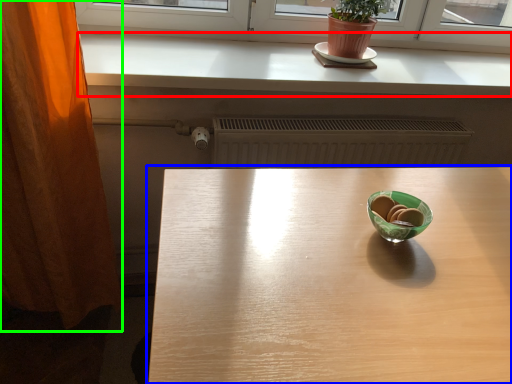
Question: Which object is the closest to the counter top (highlighted by a red box)? Choose among these: table (highlighted by a blue box) or curtain (highlighted by a green box).

Choices:
 (A) table
 (B) curtain

Answer: (B)